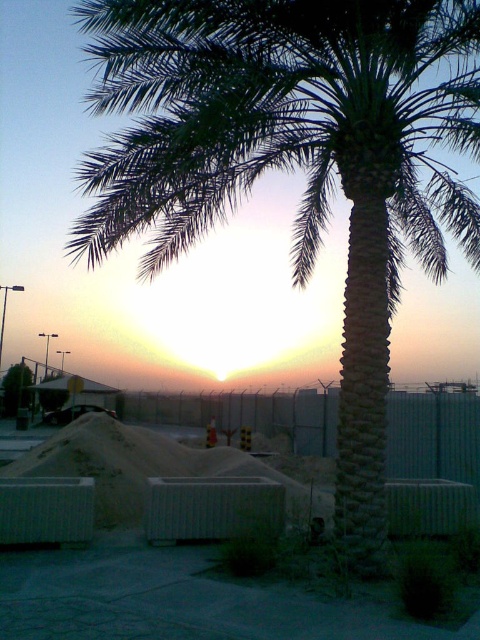
You are planning to place a new decorative statue in the garden. The statue requires a base that is wider than the green leafy palm at center. Can the white concrete mound at center serve as this base?

The white concrete mound at center is wider than the green leafy palm at center, so it can serve as the base for the statue.

You are standing in the middle of the scene and want to place a small statue on the ground. The statue requires a base that is taller than the green leafy palm at center. Can the white concrete mound at center serve as this base?

The white concrete mound at center is not as tall as the green leafy palm at center, so it cannot serve as a base for the statue that requires a taller base than the palm.